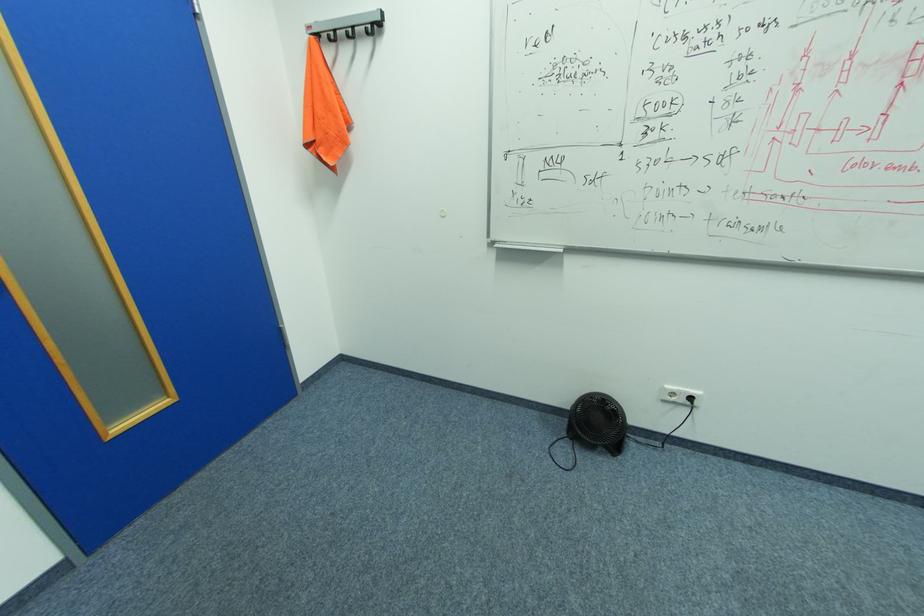
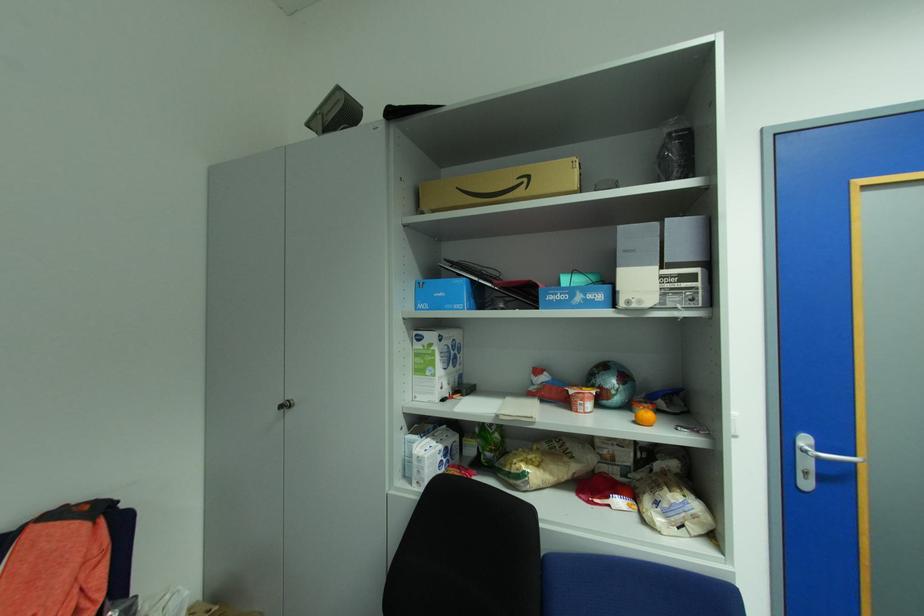
Question: The first image is from the beginning of the video and the second image is from the end. How did the camera likely rotate when shooting the video?

Choices:
 (A) Left
 (B) Right
 (C) Up
 (D) Down

Answer: (A)